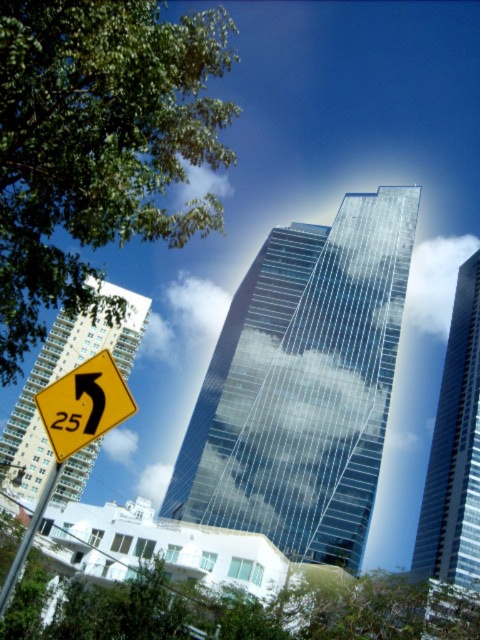
You are a pedestrian standing at the crosswalk and see the green leafy tree at upper left and the yellow plastic sign at lower left. Which object is closer to you?

The green leafy tree at upper left is closer to you than the yellow plastic sign at lower left because it is further to the viewer.

You are a drone operator trying to locate a specific point in an urban area. You see the green leafy tree at upper left in the image. What are the coordinates of its position?

The green leafy tree at upper left is located at coordinates point (97,145).

From the picture: You are standing in the urban scene and want to take a photo of both the point at [96,408] and the point at [13,570]. Which point is closer to your camera lens?

Point [13,570] is closer to the camera lens because it is less further than point [96,408].